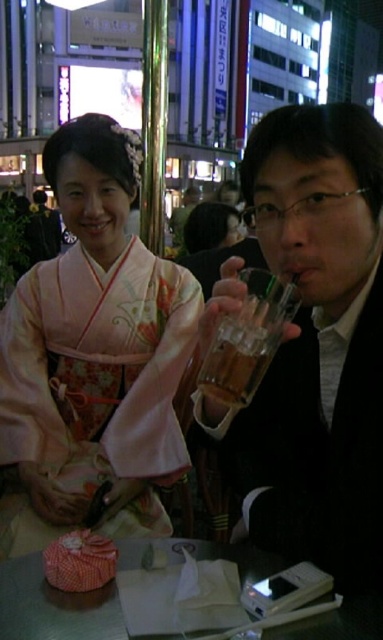
In the scene shown: You are a photographer preparing to take a closeup shot of the pink silk kimono at center and the translucent glass cup at upper center. Which object should you focus on first if you want to capture both in sharp detail without adjusting the camera focus?

You should focus on the pink silk kimono at center first because it is bigger than the translucent glass cup at upper center, so capturing it in focus will ensure the smaller object is also in sharp detail.

You are a photographer standing at the entrance of the scene. You want to take a picture of the pink silk kimono at center. Which direction should you move to get a better angle?

The pink silk kimino at center is located at point (x=94, y=352), so you should move towards the lower right to get a better angle.

You are a photographer trying to capture the pink silk kimono at center and the translucent glass cup at upper center in a single shot. Which object will appear closer to the camera in the photo?

The pink silk kimono at center will appear closer to the camera because the translucent glass cup at upper center is behind it.